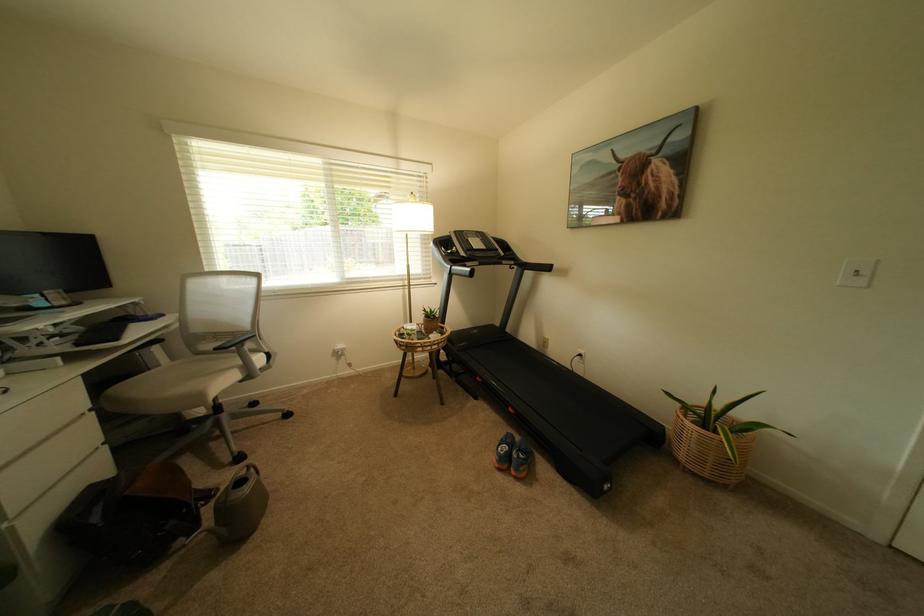
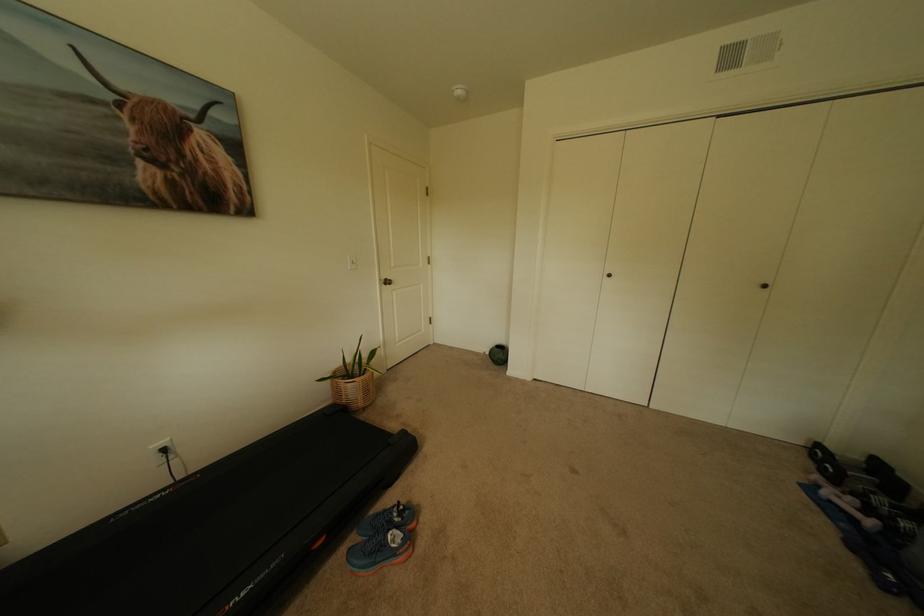
Find the pixel in the second image that matches pixel 589 355 in the first image.

(173, 451)